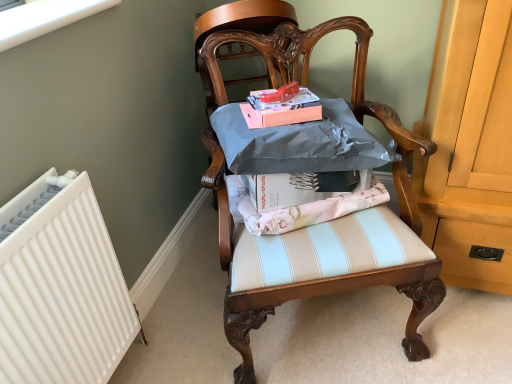
Question: Is matte silver wrapping paper at center wider than matte pink magazine at center?

Choices:
 (A) no
 (B) yes

Answer: (B)

Question: Can you confirm if matte silver wrapping paper at center is positioned to the left of matte pink magazine at center?

Choices:
 (A) no
 (B) yes

Answer: (A)

Question: Is matte silver wrapping paper at center turned away from matte pink magazine at center?

Choices:
 (A) no
 (B) yes

Answer: (A)

Question: Considering the relative sizes of matte silver wrapping paper at center and matte pink magazine at center in the image provided, is matte silver wrapping paper at center thinner than matte pink magazine at center?

Choices:
 (A) no
 (B) yes

Answer: (A)

Question: Is matte silver wrapping paper at center bigger than matte pink magazine at center?

Choices:
 (A) yes
 (B) no

Answer: (A)

Question: In terms of size, does matte silver wrapping paper at center appear bigger or smaller than matte pink magazine at center?

Choices:
 (A) big
 (B) small

Answer: (A)

Question: Is point (245, 210) positioned closer to the camera than point (279, 107)?

Choices:
 (A) farther
 (B) closer

Answer: (A)

Question: Choose the correct answer: Is matte silver wrapping paper at center inside matte pink magazine at center or outside it?

Choices:
 (A) outside
 (B) inside

Answer: (A)

Question: Relative to matte pink magazine at center, is matte silver wrapping paper at center in front or behind?

Choices:
 (A) front
 (B) behind

Answer: (B)

Question: Does point (344, 213) appear closer or farther from the camera than point (354, 64)?

Choices:
 (A) farther
 (B) closer

Answer: (B)

Question: Choose the correct answer: Is matte silver wrapping paper at center inside wooden chair at center or outside it?

Choices:
 (A) inside
 (B) outside

Answer: (A)

Question: In terms of width, does matte silver wrapping paper at center look wider or thinner when compared to wooden chair at center?

Choices:
 (A) thin
 (B) wide

Answer: (A)

Question: From their relative heights in the image, would you say matte silver wrapping paper at center is taller or shorter than wooden chair at center?

Choices:
 (A) tall
 (B) short

Answer: (B)

Question: From the image's perspective, is wooden chair at center above or below matte pink magazine at center?

Choices:
 (A) above
 (B) below

Answer: (B)

Question: Considering the positions of wooden chair at center and matte pink magazine at center in the image, is wooden chair at center taller or shorter than matte pink magazine at center?

Choices:
 (A) short
 (B) tall

Answer: (B)